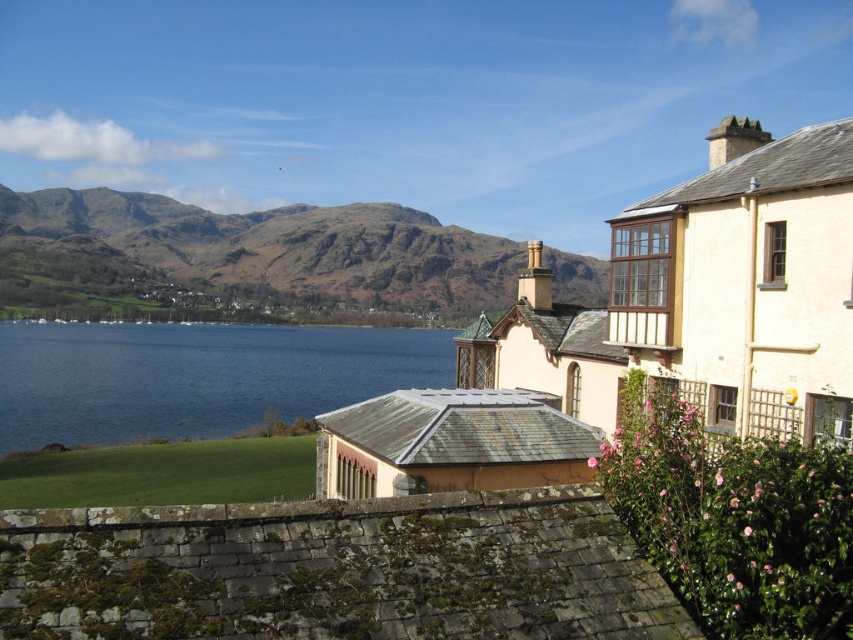
Question: Can you confirm if brown rocky mountain at upper left is thinner than blue water at lower left?

Choices:
 (A) no
 (B) yes

Answer: (A)

Question: Which point is farther from the camera taking this photo?

Choices:
 (A) (316, 221)
 (B) (83, 355)

Answer: (A)

Question: Which object is closer to the camera taking this photo?

Choices:
 (A) blue water at lower left
 (B) brown rocky mountain at upper left

Answer: (A)

Question: Which of the following is the farthest from the observer?

Choices:
 (A) blue water at lower left
 (B) brown rocky mountain at upper left

Answer: (B)

Question: Is brown rocky mountain at upper left thinner than blue water at lower left?

Choices:
 (A) no
 (B) yes

Answer: (A)

Question: Can you confirm if brown rocky mountain at upper left is positioned below blue water at lower left?

Choices:
 (A) yes
 (B) no

Answer: (B)